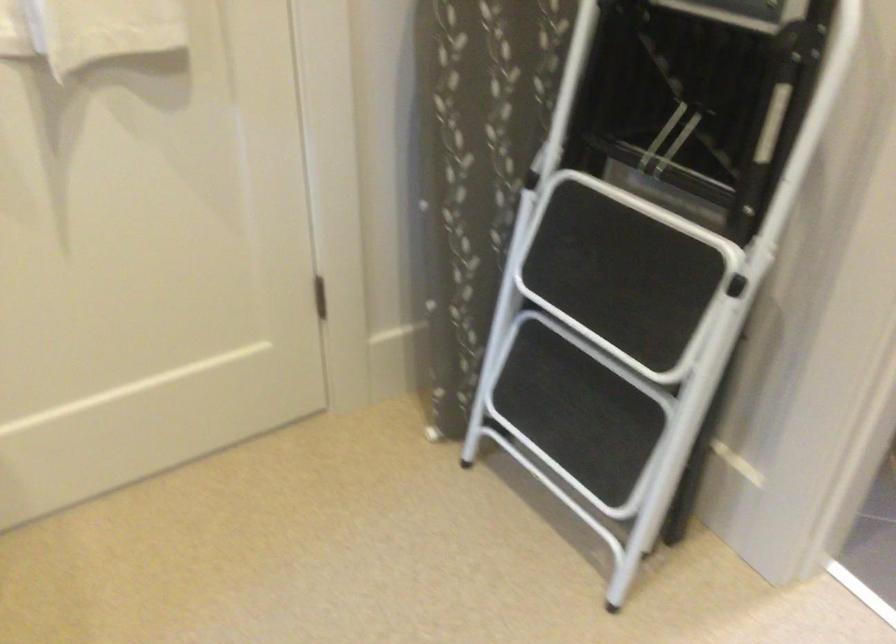
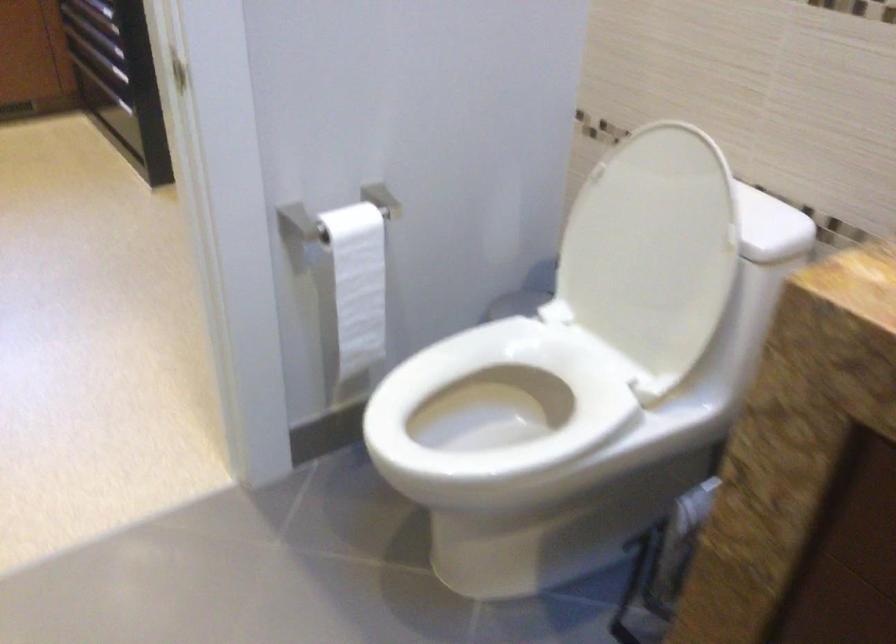
In the second image, find the point that corresponds to point 803,315 in the first image.

(357, 283)